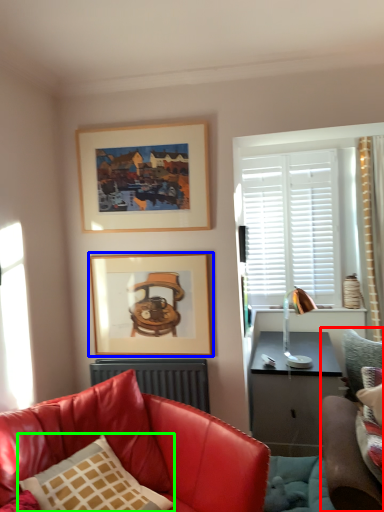
Question: Which is farther away from studio couch (highlighted by a red box)? picture frame (highlighted by a blue box) or pillow (highlighted by a green box)?

Choices:
 (A) picture frame
 (B) pillow

Answer: (A)